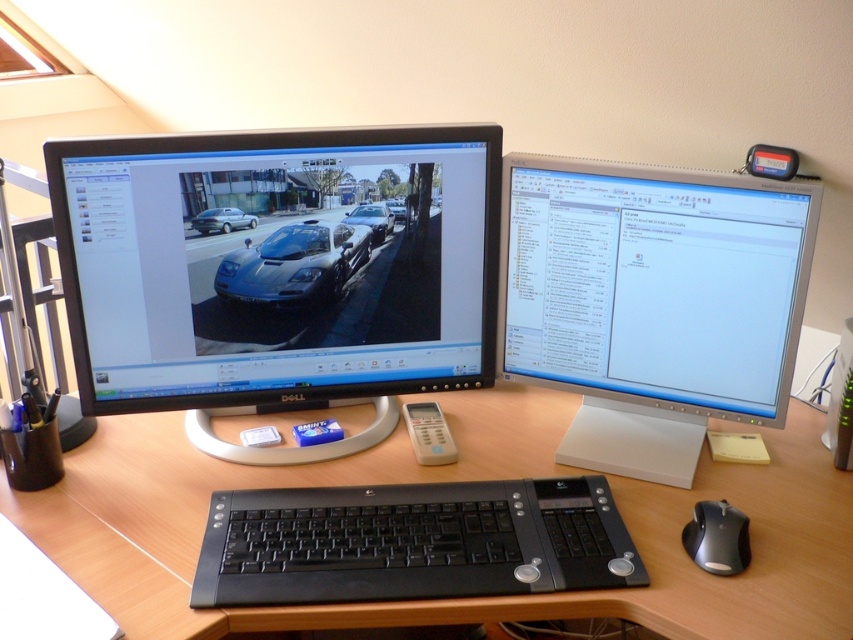
The height and width of the screenshot is (640, 853). Describe the element at coordinates (653, 301) in the screenshot. I see `satin silver monitor at upper right` at that location.

Between satin silver monitor at upper right and black plastic keyboard at center, which one appears on the right side from the viewer's perspective?

satin silver monitor at upper right

What do you see at coordinates (653, 301) in the screenshot?
I see `satin silver monitor at upper right` at bounding box center [653, 301].

Locate an element on the screen. This screenshot has height=640, width=853. satin silver monitor at upper right is located at coordinates (653, 301).

Between point (407, 161) and point (433, 605), which one is positioned in front?

Point (433, 605) is in front.

Is the position of black glossy monitor at left more distant than that of wooden desk at center?

Yes, it is.

Is point (273, 132) positioned behind point (352, 412)?

No, it is not.

Identify the location of black glossy monitor at left. The image size is (853, 640). (277, 273).

Does point (216, 220) lie in front of point (384, 209)?

Yes, point (216, 220) is closer to viewer.

Where is `glossy black car at center`? The height and width of the screenshot is (640, 853). glossy black car at center is located at coordinates (222, 220).